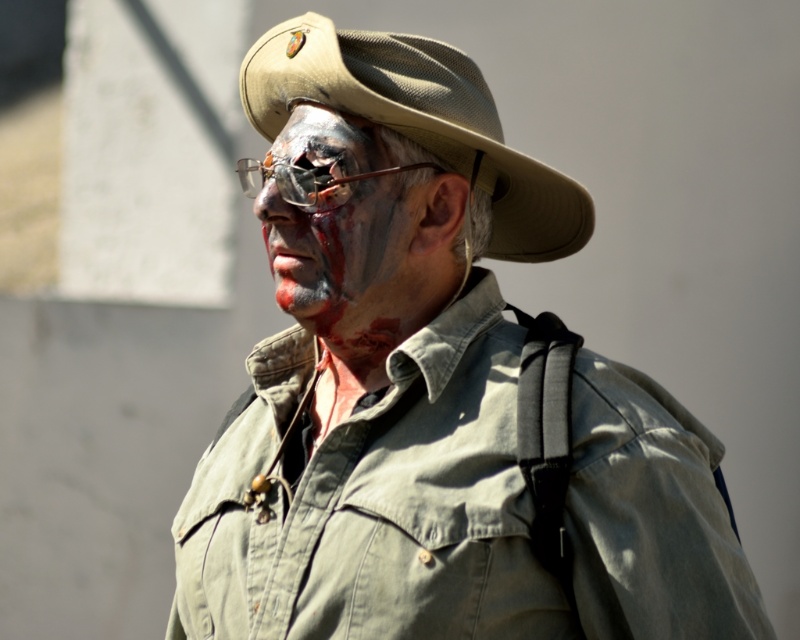
Is point (308, 54) more distant than point (393, 157)?

Yes, it is behind point (393, 157).

Which is more to the left, tan fabric fedora at center or matte gray face at center?

matte gray face at center is more to the left.

Where is `tan fabric fedora at center`? The image size is (800, 640). tan fabric fedora at center is located at coordinates (418, 122).